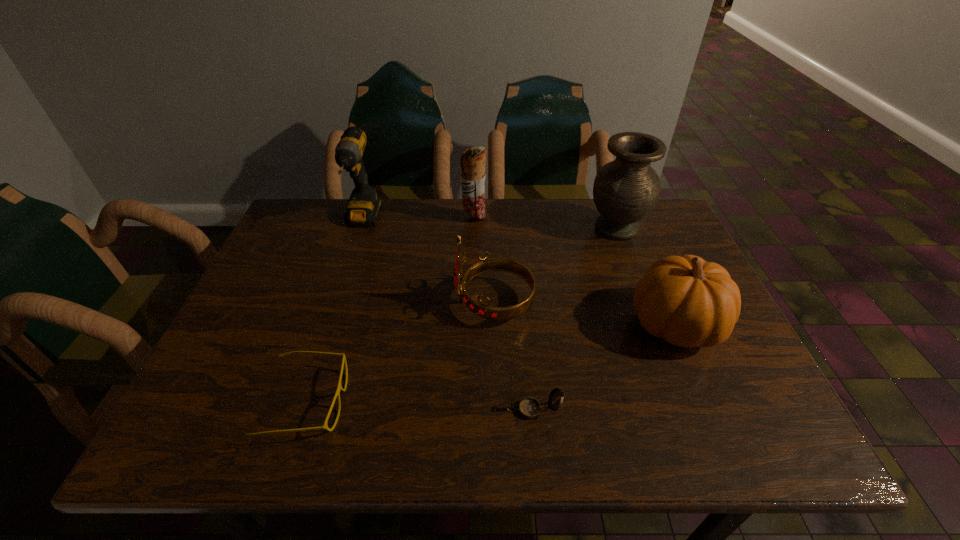
This screenshot has height=540, width=960. What are the coordinates of `vase` in the screenshot? It's located at (625, 190).

Identify the location of drill. The height and width of the screenshot is (540, 960). (364, 204).

This screenshot has width=960, height=540. In order to click on burrito in this screenshot , I will do `click(473, 160)`.

In order to click on tiara in this screenshot , I will do `click(480, 308)`.

The width and height of the screenshot is (960, 540). I want to click on pumpkin, so click(688, 302).

Image resolution: width=960 pixels, height=540 pixels. What are the coordinates of `compass` in the screenshot? It's located at (529, 408).

Find the location of a particular element. spectacles is located at coordinates (339, 388).

What are the coordinates of `vacant space located on the left of the vase` in the screenshot? It's located at (464, 228).

Where is `free space located with the drill bit of the drill facing forward`? The height and width of the screenshot is (540, 960). free space located with the drill bit of the drill facing forward is located at coordinates (350, 258).

I want to click on free space located on the left of the burrito, so click(366, 218).